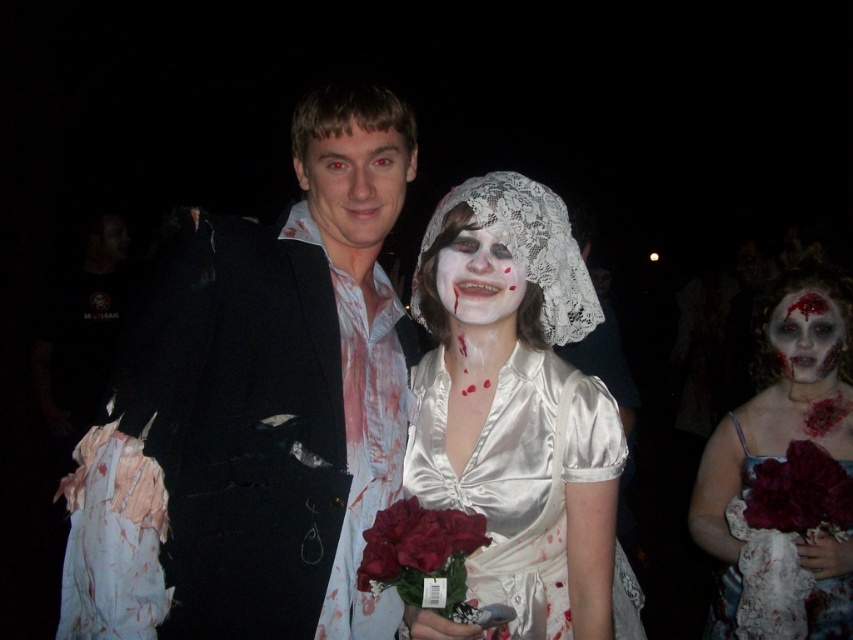
In the scene shown: You are a photographer at the Halloween event. You want to take a closeup shot of the white matte face at center and the deep red silk rose at lower right. The camera has a minimum focus distance of 15 inches. Will you be able to focus on both subjects clearly?

The distance between the deep red silk rose at lower right and the white matte face at center is 14.84 inches. Since the minimum focus distance is 15 inches, the camera cannot focus on both subjects clearly at the same time because they are too close together.

You are a photographer at the Halloween event. You want to take a photo that focuses on the deep red silk rose at lower right and the white matte face at center. Which object should you zoom in on to make sure both are clearly visible in the frame?

The deep red silk rose at lower right is bigger than the white matte face at center, so you should zoom in on the deep red silk rose at lower right to ensure both objects are clearly visible in the frame.